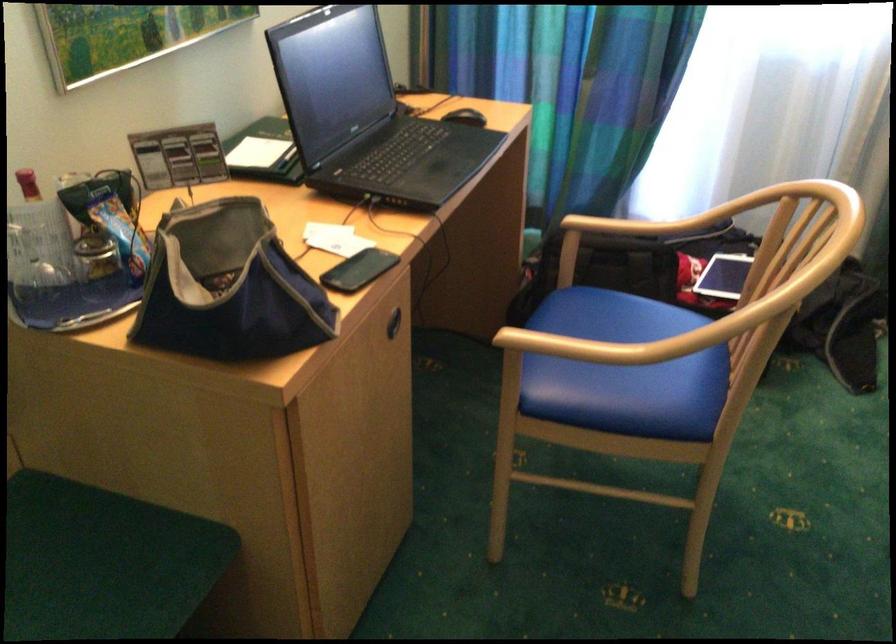
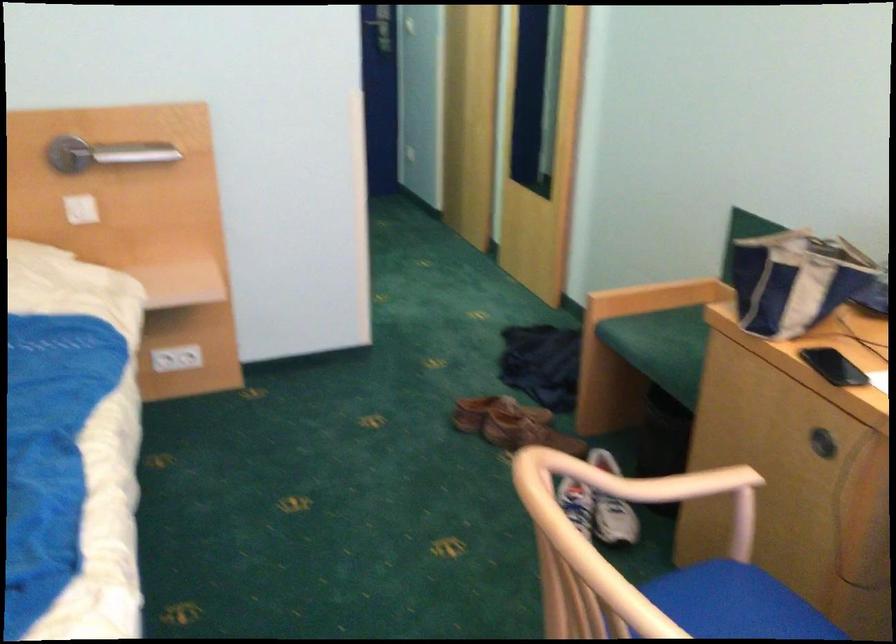
Find the pixel in the second image that matches the point at 608,346 in the first image.

(677, 507)